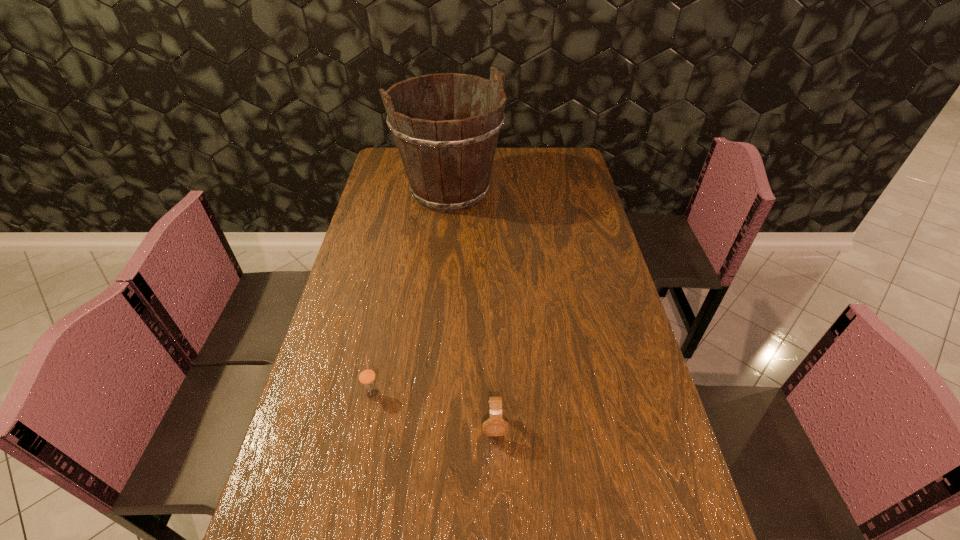
At what (x,y) coordinates should I click in order to perform the action: click on vacant area that lies between the watch and the farthest object. Please return your answer as a coordinate pair (x, y). Looking at the image, I should click on (472, 309).

Where is `blank region between the second shortest object and the watch`? The image size is (960, 540). blank region between the second shortest object and the watch is located at coordinates (434, 409).

The width and height of the screenshot is (960, 540). In order to click on object that is the second closest to the second tallest object in this screenshot , I will do `click(448, 158)`.

Find the location of a particular element. object that stands as the second closest to the watch is located at coordinates (448, 158).